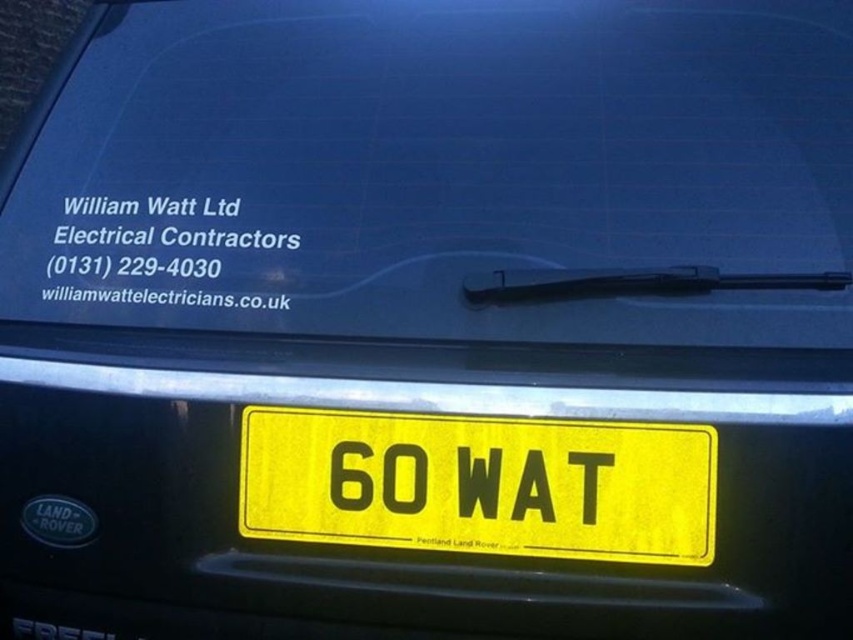
Question: Which of the following is the closest to the observer?

Choices:
 (A) transparent glass windshield at center
 (B) transparent rubber wiper at upper center
 (C) yellow matte license plate at center
 (D) white paper text at upper center

Answer: (C)

Question: Can you confirm if yellow matte license plate at center is positioned to the left of transparent rubber wiper at upper center?

Choices:
 (A) yes
 (B) no

Answer: (A)

Question: Which point is farther from the camera taking this photo?

Choices:
 (A) (434, 276)
 (B) (653, 269)
 (C) (158, 269)
 (D) (515, 554)

Answer: (C)

Question: Which is farther from the transparent rubber wiper at upper center?

Choices:
 (A) transparent glass windshield at center
 (B) yellow matte license plate at center
 (C) white paper text at upper center

Answer: (C)

Question: Is yellow matte license plate at center behind transparent rubber wiper at upper center?

Choices:
 (A) yes
 (B) no

Answer: (B)

Question: Is transparent glass windshield at center wider than yellow matte license plate at center?

Choices:
 (A) yes
 (B) no

Answer: (A)